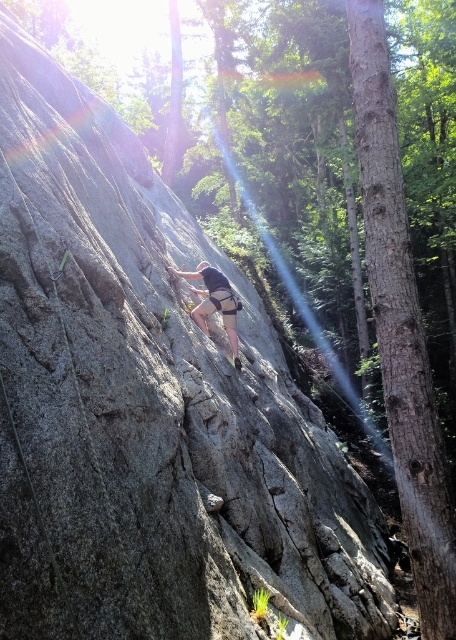
You are a rock climber attempting to reach the top of the rock face. There is a brown rough bark tree at right located at point (400, 326). Can you use this tree to aid your climb?

The brown rough bark tree at right is located at point (400, 326), which is part of the surrounding forest environment. Since the tree is positioned at the right side of the rock face, you can use its rough bark to grip and pull yourself upward during your climb.

You are a drone operator trying to capture the climber on the rock face. The brown rough bark tree at right is blocking your view. Can you adjust your drone to the left to get a clear shot of the climber?

The brown rough bark tree at right is located at point (400, 326), so adjusting the drone to the left might help avoid the tree and capture the climber.

You are a rock climber preparing to ascend the rock face. You notice the brown rough bark tree at right and the matte gray climbing harness at center. Which object is located higher up in the scene?

The brown rough bark tree at right is positioned over the matte gray climbing harness at center, so it is higher up in the scene.